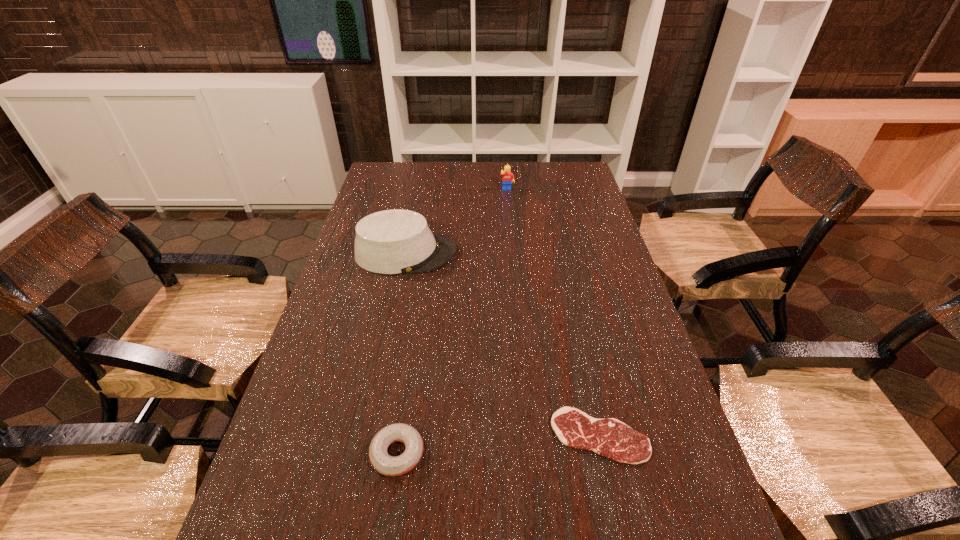
Where is `free space between the third tallest object and the third object from left to right`? free space between the third tallest object and the third object from left to right is located at coordinates (x=452, y=322).

You are a GUI agent. You are given a task and a screenshot of the screen. Output one action in this format:
    pyautogui.click(x=<x>, y=<y>)
    Task: Click on the vacant space that is in between the Lego and the second farthest object
    
    Given the screenshot: What is the action you would take?
    pyautogui.click(x=457, y=222)

Find the location of a particular element. Image resolution: width=960 pixels, height=540 pixels. free space that is in between the second farthest object and the second object from right to left is located at coordinates (457, 222).

The width and height of the screenshot is (960, 540). What are the coordinates of `vacant space that is in between the steak and the third object from left to right` in the screenshot? It's located at (553, 313).

Identify the location of vacant area between the steak and the Lego. [553, 313].

Find the location of a particular element. The image size is (960, 540). unoccupied position between the doughnut and the steak is located at coordinates (498, 445).

At what (x,y) coordinates should I click in order to perform the action: click on object that is the third closest one to the third tallest object. Please return your answer as a coordinate pair (x, y). Looking at the image, I should click on (508, 177).

Select which object is the closest to the doughnut. Please provide its 2D coordinates. Your answer should be formatted as a tuple, i.e. [(x, y)], where the tuple contains the x and y coordinates of a point satisfying the conditions above.

[(608, 437)]

Locate an element on the screen. vacant point that satisfies the following two spatial constraints: 1. on the front-facing side of the hat; 2. on the right side of the rightmost object is located at coordinates (369, 436).

Find the location of `vacant space that satisfies the following two spatial constraints: 1. on the face of the Lego; 2. on the front-facing side of the hat`. vacant space that satisfies the following two spatial constraints: 1. on the face of the Lego; 2. on the front-facing side of the hat is located at coordinates (513, 253).